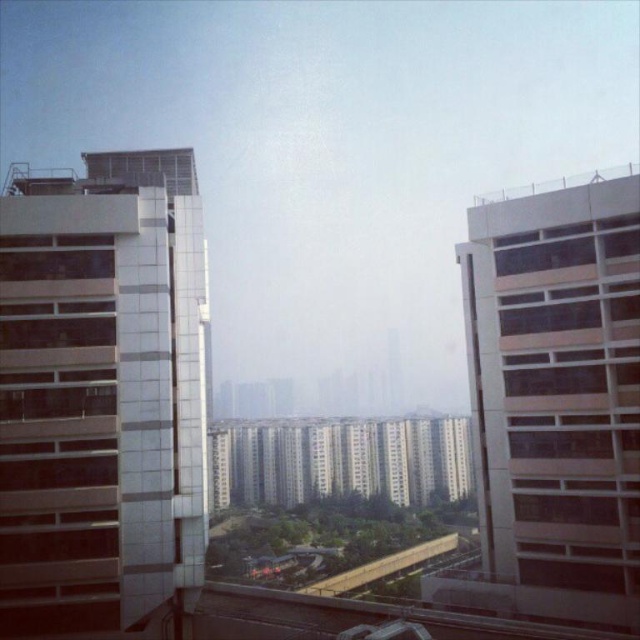
Between matte beige building at right and white glossy building at center, which one is positioned lower?

Positioned lower is white glossy building at center.

Who is positioned more to the right, matte beige building at right or white glossy building at center?

matte beige building at right

Is point (630, 404) farther from viewer compared to point (307, 472)?

No.

At what (x,y) coordinates should I click in order to perform the action: click on matte beige building at right. Please return your answer as a coordinate pair (x, y). This screenshot has width=640, height=640. Looking at the image, I should click on (557, 394).

How much distance is there between metallic glass building at left and matte beige building at right?

metallic glass building at left and matte beige building at right are 16.02 meters apart.

How much distance is there between metallic glass building at left and matte beige building at right?

16.02 meters

Does point (145, 205) lie in front of point (529, 337)?

No, it is not.

This screenshot has height=640, width=640. Find the location of `metallic glass building at left`. metallic glass building at left is located at coordinates (100, 392).

Can you confirm if metallic glass building at left is bigger than white glossy building at center?

Incorrect, metallic glass building at left is not larger than white glossy building at center.

How much distance is there between metallic glass building at left and white glossy building at center?

80.26 meters

The image size is (640, 640). I want to click on metallic glass building at left, so click(100, 392).